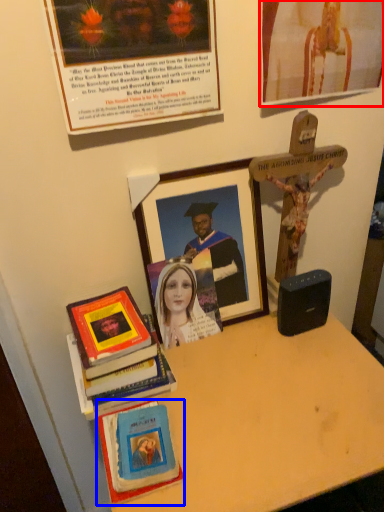
Question: Which object appears farthest to the camera in this image, picture frame (highlighted by a red box) or book (highlighted by a blue box)?

Choices:
 (A) picture frame
 (B) book

Answer: (B)